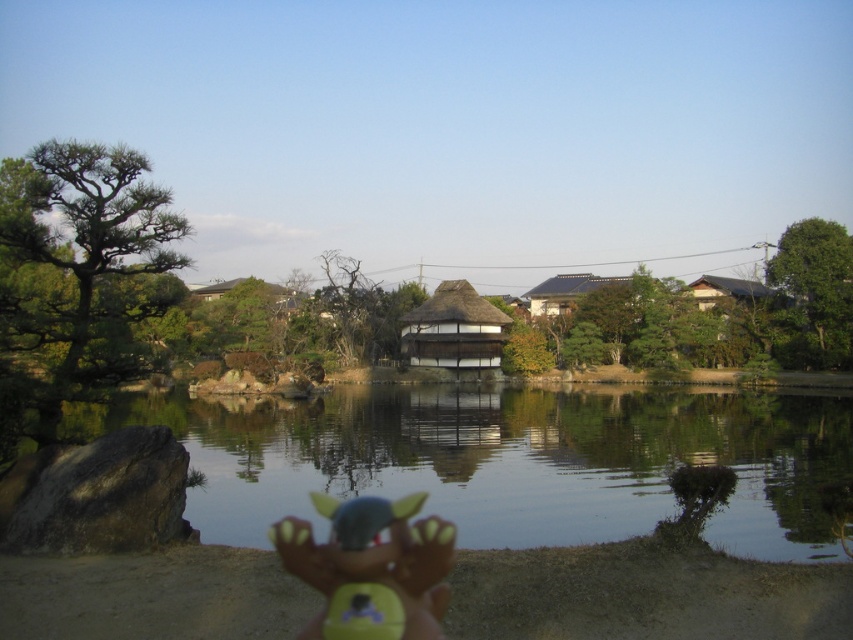
You are planning to build a new structure on the lakeside. You have two options based on the image provided. The first option is to build a thatched roof hut at center, and the second is a brown wooden hut at upper right. Which of these two structures takes up more area in the image?

The brown wooden hut at upper right occupies more space than the thatched roof hut at center according to the description.

You are standing at the lakeside and want to take a photo of both the transparent water at center and the brown wooden hut at upper right. Which object should you adjust your camera angle to include first if you want to capture both in one frame?

The transparent water at center is not as tall as the brown wooden hut at upper right, so you should adjust your camera angle to include the brown wooden hut at upper right first since it is taller and might be partially obscured if not framed properly.